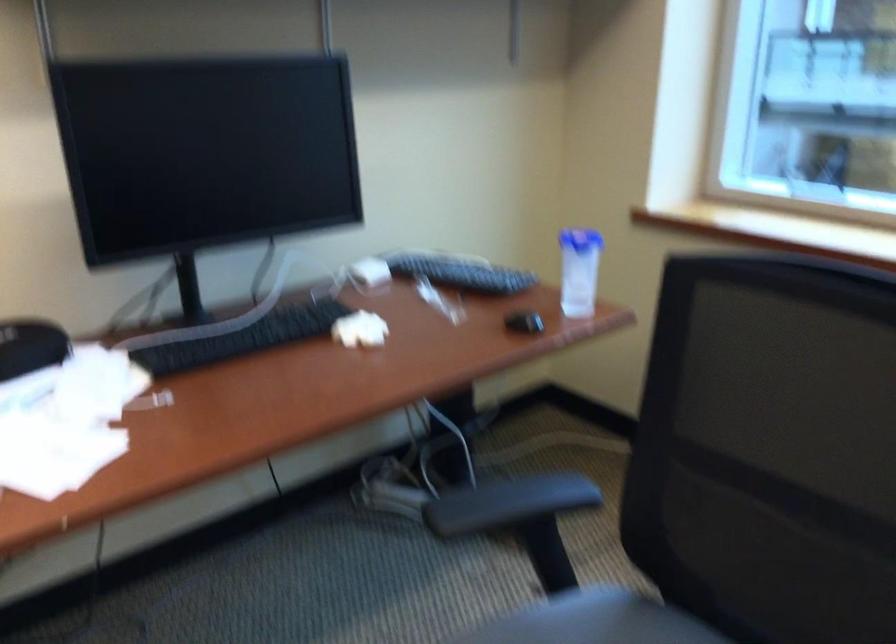
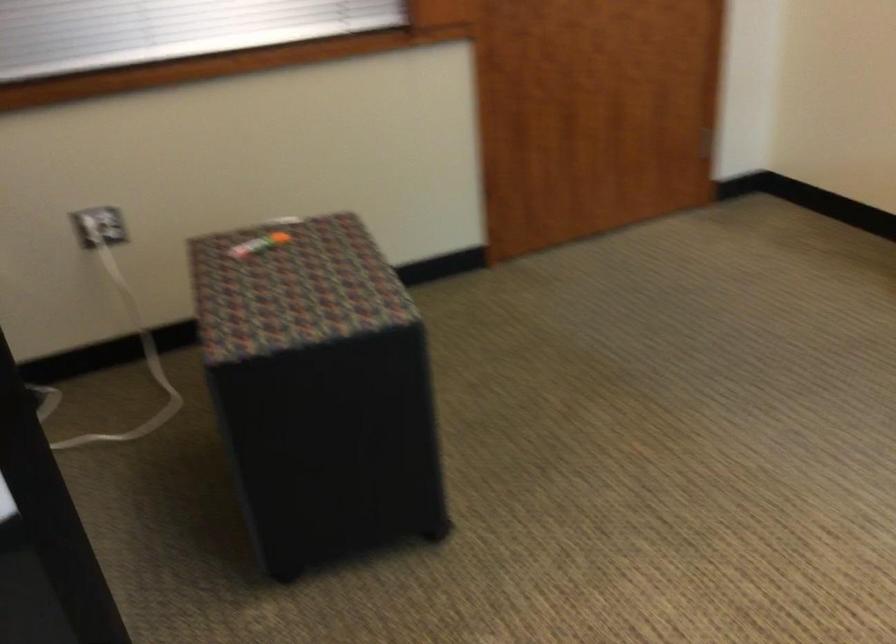
In the scene shown: The first image is from the beginning of the video and the second image is from the end. How did the camera likely rotate when shooting the video?

The rotation direction of the camera is left-down.